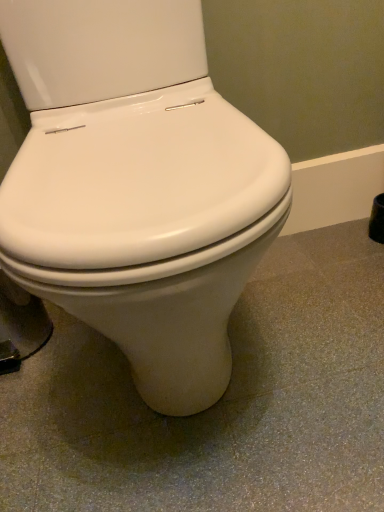
Question: Should I look upward or downward to see white glossy toilet at center?

Choices:
 (A) down
 (B) up

Answer: (B)